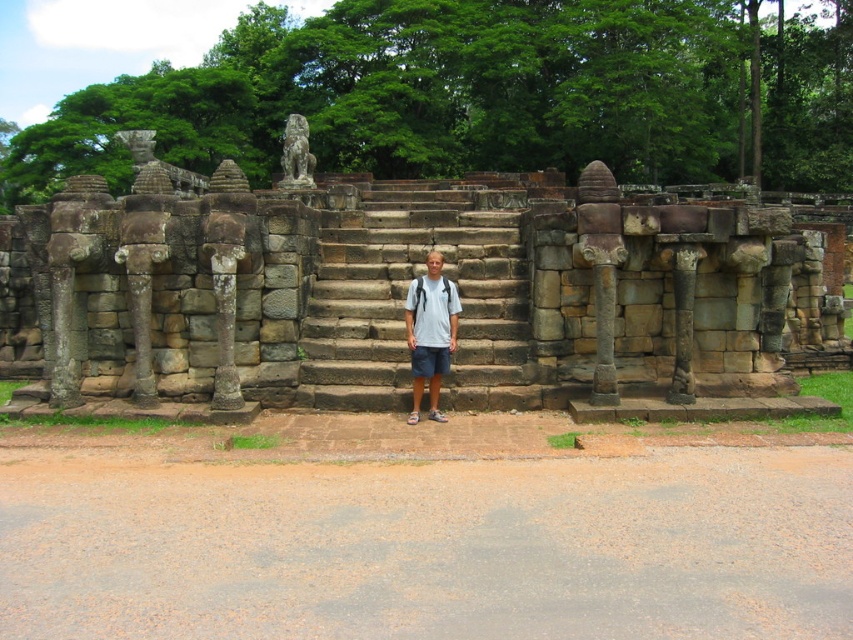
You are standing in front of the ancient stone structure. You want to take a photo of the stone wall at center. Where should you position yourself to capture it in the frame?

To capture the stone wall at center in your photo, position yourself directly in front of it, as it is located at the central point of the structure marked by coordinates point (x=405, y=292).

You are a tour guide explaining the historical site to visitors. You point to the person in the image wearing the white cotton shirt at center and dark blue cotton shorts at center. Which item of clothing is positioned higher on their body?

The white cotton shirt at center is located above the dark blue cotton shorts at center, so the white cotton shirt at center is positioned higher on their body.

You are a photographer planning to take a picture of the brown stone stairs at center and the white cotton shirt at center. Which object should you focus on first if you want to capture both in sharp focus?

The brown stone stairs at center should be focused on first because it is wider than the white cotton shirt at center, ensuring both can be in focus when using a shallow depth of field.